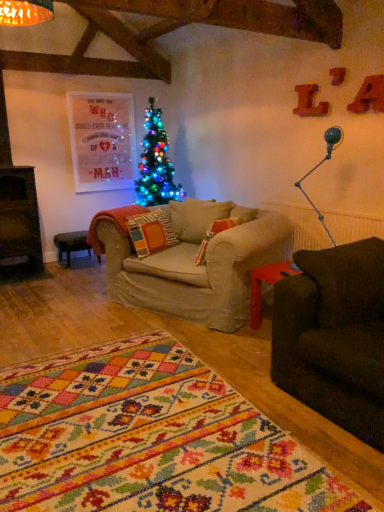
Question: In terms of width, does black leather stool at lower left look wider or thinner when compared to metallic blue lamp at right?

Choices:
 (A) thin
 (B) wide

Answer: (B)

Question: Do you think black leather stool at lower left is within metallic blue lamp at right, or outside of it?

Choices:
 (A) inside
 (B) outside

Answer: (B)

Question: Is black leather stool at lower left taller or shorter than metallic blue lamp at right?

Choices:
 (A) tall
 (B) short

Answer: (B)

Question: Is metallic blue lamp at right inside the boundaries of black leather stool at lower left, or outside?

Choices:
 (A) outside
 (B) inside

Answer: (A)

Question: In terms of height, does metallic blue lamp at right look taller or shorter compared to black leather stool at lower left?

Choices:
 (A) tall
 (B) short

Answer: (A)

Question: Does point (336, 142) appear closer or farther from the camera than point (77, 247)?

Choices:
 (A) closer
 (B) farther

Answer: (A)

Question: From the image's perspective, is metallic blue lamp at right above or below black leather stool at lower left?

Choices:
 (A) below
 (B) above

Answer: (B)